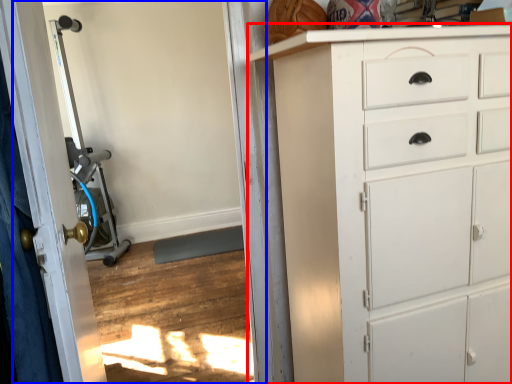
Question: Which of the following is the closest to the observer, chest of drawers (highlighted by a red box) or screen door (highlighted by a blue box)?

Choices:
 (A) chest of drawers
 (B) screen door

Answer: (A)